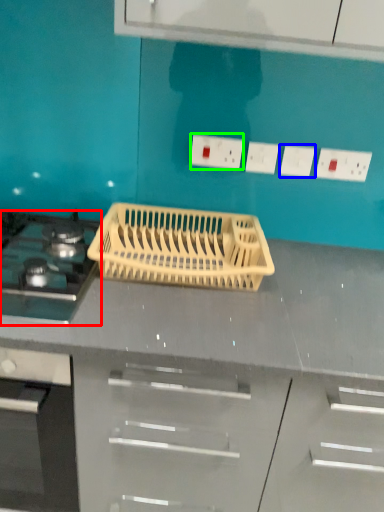
Question: Estimate the real-world distances between objects in this image. Which object is farther from gas stove (highlighted by a red box), electric outlet (highlighted by a blue box) or electric outlet (highlighted by a green box)?

Choices:
 (A) electric outlet
 (B) electric outlet

Answer: (A)